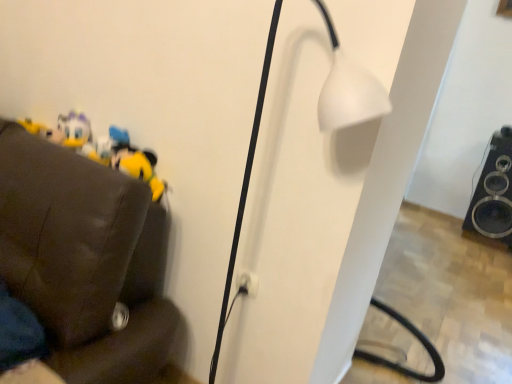
Question: Is white matte lamp at center positioned in front of yellow plush toy at left?

Choices:
 (A) yes
 (B) no

Answer: (A)

Question: Can you confirm if white matte lamp at center is taller than yellow plush toy at left?

Choices:
 (A) yes
 (B) no

Answer: (A)

Question: Does white matte lamp at center have a smaller size compared to yellow plush toy at left?

Choices:
 (A) no
 (B) yes

Answer: (A)

Question: From a real-world perspective, is white matte lamp at center located beneath yellow plush toy at left?

Choices:
 (A) no
 (B) yes

Answer: (B)

Question: Considering the relative sizes of white matte lamp at center and yellow plush toy at left in the image provided, is white matte lamp at center shorter than yellow plush toy at left?

Choices:
 (A) yes
 (B) no

Answer: (B)

Question: Looking at the image, does black glossy speaker at lower right seem bigger or smaller compared to white matte lamp at center?

Choices:
 (A) big
 (B) small

Answer: (A)

Question: In terms of height, does black glossy speaker at lower right look taller or shorter compared to white matte lamp at center?

Choices:
 (A) tall
 (B) short

Answer: (B)

Question: Is black glossy speaker at lower right inside the boundaries of white matte lamp at center, or outside?

Choices:
 (A) inside
 (B) outside

Answer: (B)

Question: Is black glossy speaker at lower right to the left or to the right of white matte lamp at center in the image?

Choices:
 (A) left
 (B) right

Answer: (B)

Question: Is yellow plush toy at left taller or shorter than black glossy speaker at lower right?

Choices:
 (A) tall
 (B) short

Answer: (B)

Question: From a real-world perspective, is yellow plush toy at left physically located above or below black glossy speaker at lower right?

Choices:
 (A) below
 (B) above

Answer: (B)

Question: Would you say yellow plush toy at left is to the left or to the right of black glossy speaker at lower right in the picture?

Choices:
 (A) right
 (B) left

Answer: (B)

Question: Considering their positions, is yellow plush toy at left located in front of or behind black glossy speaker at lower right?

Choices:
 (A) front
 (B) behind

Answer: (A)

Question: Looking at the image, does white plastic electric outlet at center seem bigger or smaller compared to yellow plush toy at left?

Choices:
 (A) big
 (B) small

Answer: (B)

Question: Looking at their shapes, would you say white plastic electric outlet at center is wider or thinner than yellow plush toy at left?

Choices:
 (A) wide
 (B) thin

Answer: (B)